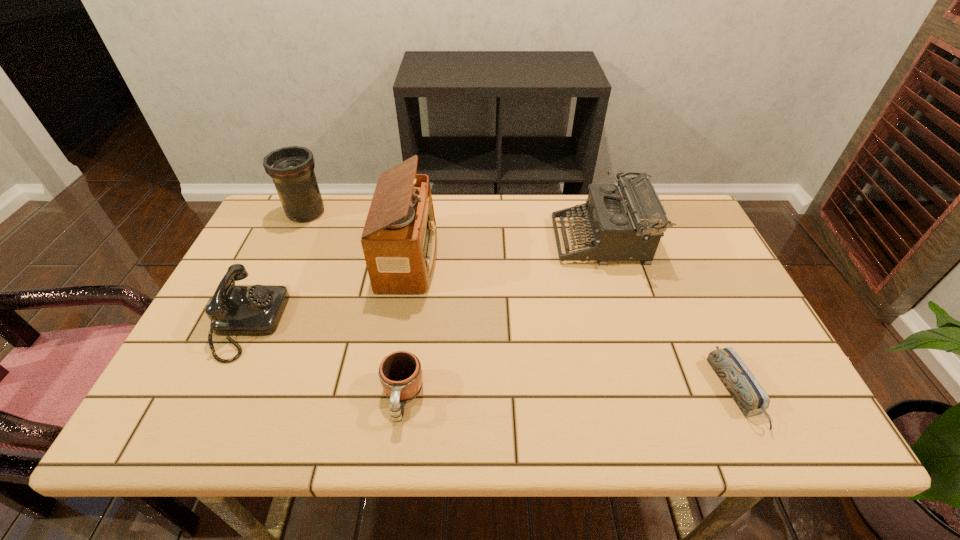
This screenshot has width=960, height=540. In order to click on telephone that is at the left edge in this screenshot , I will do `click(234, 310)`.

Where is `object present at the right edge`? Image resolution: width=960 pixels, height=540 pixels. object present at the right edge is located at coordinates click(750, 397).

Locate an element on the screen. The height and width of the screenshot is (540, 960). object present at the far left corner is located at coordinates (292, 168).

Where is `object that is at the near right corner`? This screenshot has height=540, width=960. object that is at the near right corner is located at coordinates (750, 397).

Where is `vacant space at the far edge of the desktop`? The height and width of the screenshot is (540, 960). vacant space at the far edge of the desktop is located at coordinates (495, 242).

This screenshot has width=960, height=540. What are the coordinates of `vacant space at the near edge of the desktop` in the screenshot? It's located at (299, 415).

Find the location of a particular element. vacant space at the left edge of the desktop is located at coordinates (180, 380).

You are a GUI agent. You are given a task and a screenshot of the screen. Output one action in this format:
    pyautogui.click(x=<x>, y=<y>)
    Task: Click on the free space at the right edge of the desktop
    The image size is (960, 540).
    Given the screenshot: What is the action you would take?
    pyautogui.click(x=695, y=268)

Image resolution: width=960 pixels, height=540 pixels. What are the coordinates of `vacant space at the near left corner` in the screenshot? It's located at (204, 409).

What are the coordinates of `free space that is in between the telephoto lens and the telephone` in the screenshot? It's located at (277, 268).